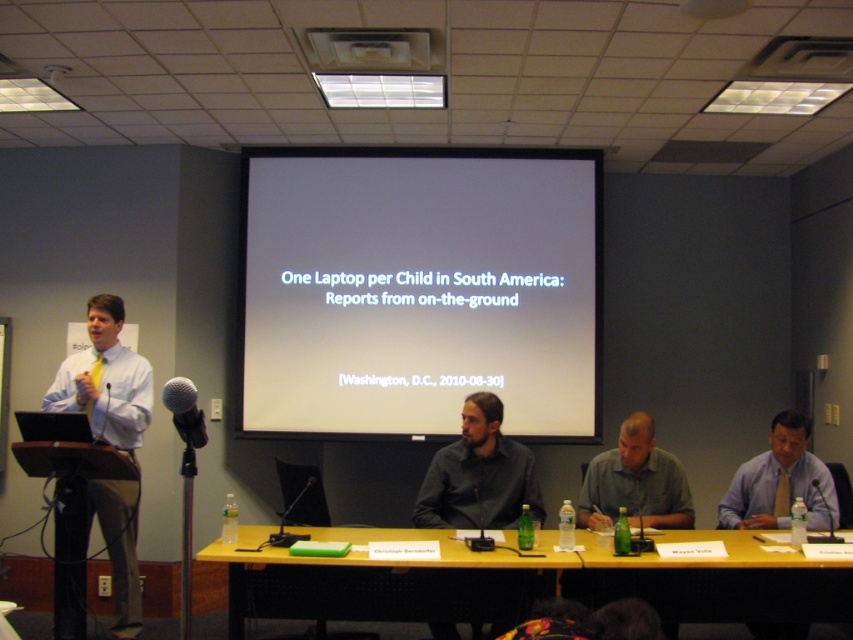
You are standing in the conference room and need to place a small laptop on the yellow plastic table at lower center. According to the coordinates provided, where exactly should you place the laptop on the table?

The yellow plastic table at lower center is located at coordinates point (527, 582), so you should place the laptop at that exact position on the table.

You are attending a conference and see two presenters wearing a white shirt at left and a light blue shirt at center. Which presenter is positioned further away from the entrance of the room?

The light blue shirt at center is positioned further away from the entrance because it is behind the white shirt at left, indicating it is farther from the front of the room.